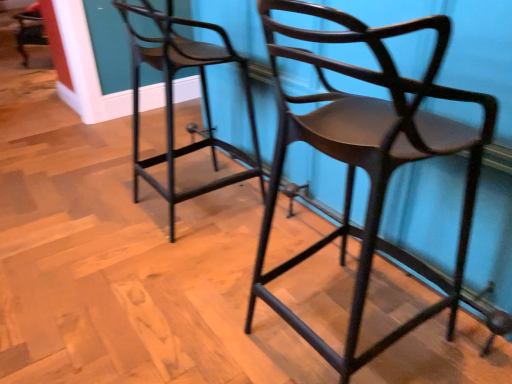
This screenshot has height=384, width=512. What do you see at coordinates (368, 160) in the screenshot? I see `matte dark wood chair at center, which is counted as the second chair, starting from the left` at bounding box center [368, 160].

Find the location of a particular element. This screenshot has height=384, width=512. matte dark wood chair at center, which is counted as the second chair, starting from the left is located at coordinates (368, 160).

The height and width of the screenshot is (384, 512). Identify the location of matte black stool at center, positioned as the 1th chair in left-to-right order. coord(172,98).

What do you see at coordinates (172, 98) in the screenshot?
I see `matte black stool at center, positioned as the 1th chair in left-to-right order` at bounding box center [172, 98].

Identify the location of matte dark wood chair at center, which is counted as the second chair, starting from the left. The height and width of the screenshot is (384, 512). (368, 160).

Between matte dark wood chair at center, which is counted as the second chair, starting from the left, and matte black stool at center, the 2th chair positioned from the right, which one appears on the right side from the viewer's perspective?

matte dark wood chair at center, which is counted as the second chair, starting from the left, is more to the right.

Considering the positions of objects matte dark wood chair at center, which is counted as the second chair, starting from the left, and matte black stool at center, the 2th chair positioned from the right, in the image provided, who is in front, matte dark wood chair at center, which is counted as the second chair, starting from the left, or matte black stool at center, the 2th chair positioned from the right,?

matte dark wood chair at center, which is counted as the second chair, starting from the left.

Does point (439, 303) appear closer or farther from the camera than point (167, 62)?

Point (439, 303) is positioned closer to the camera compared to point (167, 62).

From the image's perspective, is matte dark wood chair at center, the 1th chair viewed from the right, located above or below matte black stool at center, positioned as the 1th chair in left-to-right order?

Based on their image positions, matte dark wood chair at center, the 1th chair viewed from the right, is located beneath matte black stool at center, positioned as the 1th chair in left-to-right order.

From a real-world perspective, does matte dark wood chair at center, the 1th chair viewed from the right, sit lower than matte black stool at center, the 2th chair positioned from the right?

No.

In the scene shown: Considering the sizes of matte dark wood chair at center, which is counted as the second chair, starting from the left, and matte black stool at center, the 2th chair positioned from the right, in the image, is matte dark wood chair at center, which is counted as the second chair, starting from the left, wider or thinner than matte black stool at center, the 2th chair positioned from the right,?

Considering their sizes, matte dark wood chair at center, which is counted as the second chair, starting from the left, looks broader than matte black stool at center, the 2th chair positioned from the right.

Is matte dark wood chair at center, which is counted as the second chair, starting from the left, taller than matte black stool at center, positioned as the 1th chair in left-to-right order?

Yes.

Considering the relative sizes of matte dark wood chair at center, which is counted as the second chair, starting from the left, and matte black stool at center, positioned as the 1th chair in left-to-right order, in the image provided, is matte dark wood chair at center, which is counted as the second chair, starting from the left, smaller than matte black stool at center, positioned as the 1th chair in left-to-right order,?

Actually, matte dark wood chair at center, which is counted as the second chair, starting from the left, might be larger than matte black stool at center, positioned as the 1th chair in left-to-right order.

Is matte dark wood chair at center, the 1th chair viewed from the right, outside of matte black stool at center, the 2th chair positioned from the right?

matte dark wood chair at center, the 1th chair viewed from the right, is positioned outside matte black stool at center, the 2th chair positioned from the right.

Is matte dark wood chair at center, which is counted as the second chair, starting from the left, next to matte black stool at center, the 2th chair positioned from the right, and touching it?

No, matte dark wood chair at center, which is counted as the second chair, starting from the left, is not with matte black stool at center, the 2th chair positioned from the right.

Is matte dark wood chair at center, the 1th chair viewed from the right, aimed at matte black stool at center, the 2th chair positioned from the right?

No, matte dark wood chair at center, the 1th chair viewed from the right, does not turn towards matte black stool at center, the 2th chair positioned from the right.

What's the angular difference between matte dark wood chair at center, the 1th chair viewed from the right, and matte black stool at center, the 2th chair positioned from the right,'s facing directions?

0.000965 degrees separate the facing orientations of matte dark wood chair at center, the 1th chair viewed from the right, and matte black stool at center, the 2th chair positioned from the right.

Where is `chair to the left of matte dark wood chair at center, which is counted as the second chair, starting from the left`? The width and height of the screenshot is (512, 384). chair to the left of matte dark wood chair at center, which is counted as the second chair, starting from the left is located at coordinates (172, 98).

Based on their positions, is matte black stool at center, positioned as the 1th chair in left-to-right order, located to the left or right of matte dark wood chair at center, the 1th chair viewed from the right?

In the image, matte black stool at center, positioned as the 1th chair in left-to-right order, appears on the left side of matte dark wood chair at center, the 1th chair viewed from the right.

Is matte black stool at center, the 2th chair positioned from the right, positioned behind matte dark wood chair at center, the 1th chair viewed from the right?

Yes, matte black stool at center, the 2th chair positioned from the right, is further from the camera.

Is point (216, 145) behind point (281, 308)?

Yes, point (216, 145) is farther from viewer.

From the image's perspective, between matte black stool at center, the 2th chair positioned from the right, and matte dark wood chair at center, the 1th chair viewed from the right, who is located below?

From the image's view, matte dark wood chair at center, the 1th chair viewed from the right, is below.

From a real-world perspective, is matte black stool at center, positioned as the 1th chair in left-to-right order, beneath matte dark wood chair at center, the 1th chair viewed from the right?

Yes.

Can you confirm if matte black stool at center, positioned as the 1th chair in left-to-right order, is thinner than matte dark wood chair at center, the 1th chair viewed from the right?

Indeed, matte black stool at center, positioned as the 1th chair in left-to-right order, has a lesser width compared to matte dark wood chair at center, the 1th chair viewed from the right.

Which of these two, matte black stool at center, positioned as the 1th chair in left-to-right order, or matte dark wood chair at center, the 1th chair viewed from the right, stands taller?

Standing taller between the two is matte dark wood chair at center, the 1th chair viewed from the right.

Who is smaller, matte black stool at center, positioned as the 1th chair in left-to-right order, or matte dark wood chair at center, which is counted as the second chair, starting from the left?

matte black stool at center, positioned as the 1th chair in left-to-right order, is smaller.

Is matte black stool at center, the 2th chair positioned from the right, spatially inside matte dark wood chair at center, the 1th chair viewed from the right, or outside of it?

matte black stool at center, the 2th chair positioned from the right, is not inside matte dark wood chair at center, the 1th chair viewed from the right, it's outside.

Is matte black stool at center, positioned as the 1th chair in left-to-right order, beside matte dark wood chair at center, the 1th chair viewed from the right?

No, matte black stool at center, positioned as the 1th chair in left-to-right order, is not in contact with matte dark wood chair at center, the 1th chair viewed from the right.

Is matte black stool at center, positioned as the 1th chair in left-to-right order, oriented away from matte dark wood chair at center, the 1th chair viewed from the right?

No, matte black stool at center, positioned as the 1th chair in left-to-right order, is not facing away from matte dark wood chair at center, the 1th chair viewed from the right.

The width and height of the screenshot is (512, 384). In order to click on chair above the matte dark wood chair at center, the 1th chair viewed from the right (from the image's perspective) in this screenshot , I will do `click(172, 98)`.

The height and width of the screenshot is (384, 512). Find the location of `chair below the matte dark wood chair at center, which is counted as the second chair, starting from the left (from a real-world perspective)`. chair below the matte dark wood chair at center, which is counted as the second chair, starting from the left (from a real-world perspective) is located at coordinates (172, 98).

I want to click on chair on the right side of matte black stool at center, the 2th chair positioned from the right, so click(x=368, y=160).